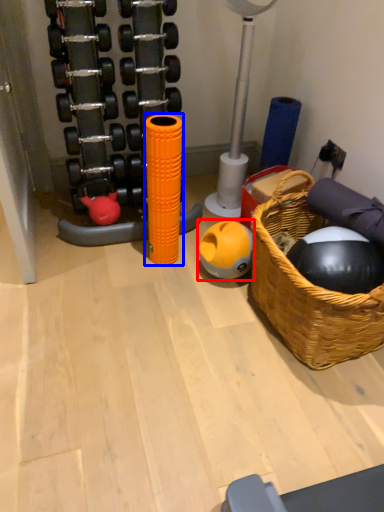
Question: Which object is further to the camera taking this photo, ball (highlighted by a red box) or toy (highlighted by a blue box)?

Choices:
 (A) ball
 (B) toy

Answer: (A)